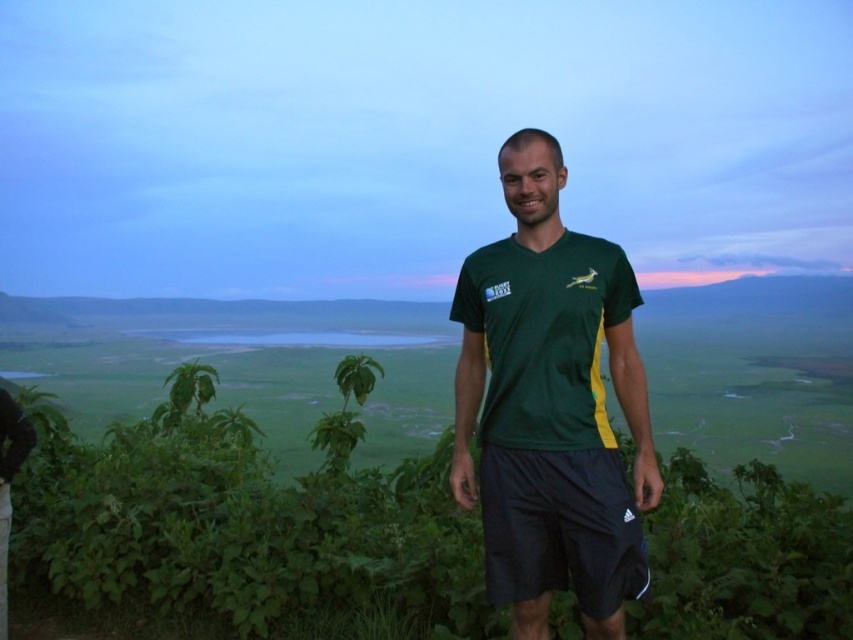
Consider the image. You are a photographer trying to capture a clear shot of the green matte shirt at center while also including the green leafy shrubs at center in the frame. Based on their positions, which object should you focus on first to ensure both are in the shot?

The green leafy shrubs at center is positioned on the left side of green matte shirt at center, so you should focus on the green leafy shrubs at center first to ensure both are in the shot.

You are standing in the serene landscape scene described. There is a point at coordinates (242, 524). What object is located at that point?

The green leafy shrubs at center are located at point (242, 524).